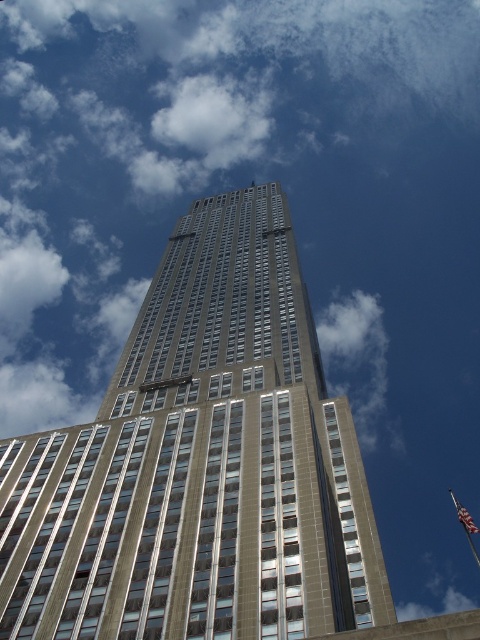
Does beige glass skyscraper at center appear over american flag at upper right?

Indeed, beige glass skyscraper at center is positioned over american flag at upper right.

Is beige glass skyscraper at center positioned before american flag at upper right?

Yes, beige glass skyscraper at center is in front of american flag at upper right.

At what (x,y) coordinates should I click in order to perform the action: click on beige glass skyscraper at center. Please return your answer as a coordinate pair (x, y). Image resolution: width=480 pixels, height=640 pixels. Looking at the image, I should click on (200, 465).

Where is `beige glass skyscraper at center`? This screenshot has width=480, height=640. beige glass skyscraper at center is located at coordinates (200, 465).